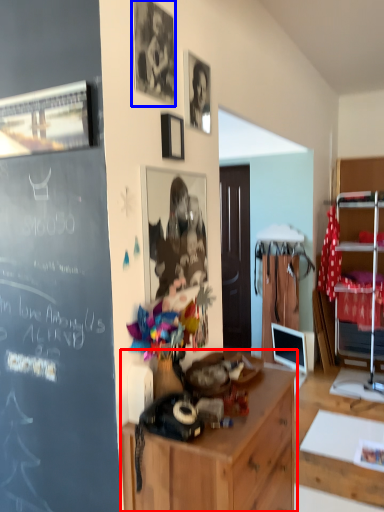
Question: Among these objects, which one is farthest to the camera, cabinetry (highlighted by a red box) or picture frame (highlighted by a blue box)?

Choices:
 (A) cabinetry
 (B) picture frame

Answer: (B)